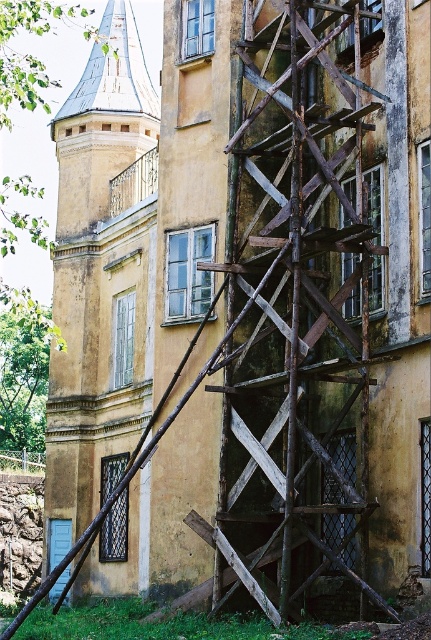
Question: Which point appears closest to the camera in this image?

Choices:
 (A) (140, 307)
 (B) (309, 481)

Answer: (B)

Question: Is rusty wood scaffolding at center above matte yellow tower at center?

Choices:
 (A) yes
 (B) no

Answer: (B)

Question: Is rusty wood scaffolding at center thinner than matte yellow tower at center?

Choices:
 (A) yes
 (B) no

Answer: (A)

Question: Can you confirm if rusty wood scaffolding at center is positioned below matte yellow tower at center?

Choices:
 (A) no
 (B) yes

Answer: (B)